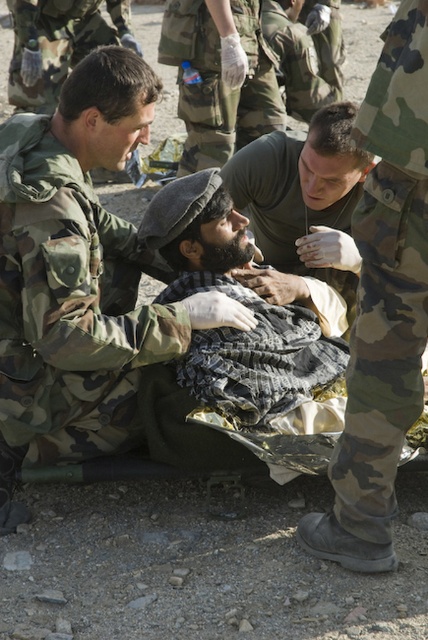
Question: Among these points, which one is nearest to the camera?

Choices:
 (A) (61, 179)
 (B) (258, 424)
 (C) (324, 376)

Answer: (A)

Question: Based on their relative distances, which object is farther from the textured gray blanket at center?

Choices:
 (A) camouflage fabric uniform at upper left
 (B) dark gray fabric at center
 (C) matte green uniform at center

Answer: (A)

Question: Is camouflage uniform at center below camo fabric pants at right?

Choices:
 (A) no
 (B) yes

Answer: (A)

Question: Does camouflage uniform at center appear under matte green uniform at center?

Choices:
 (A) no
 (B) yes

Answer: (B)

Question: Which object appears closest to the camera in this image?

Choices:
 (A) camo fabric pants at right
 (B) camouflage uniform at center
 (C) matte green uniform at center

Answer: (A)

Question: Is camouflage uniform at center positioned at the back of textured gray blanket at center?

Choices:
 (A) yes
 (B) no

Answer: (B)